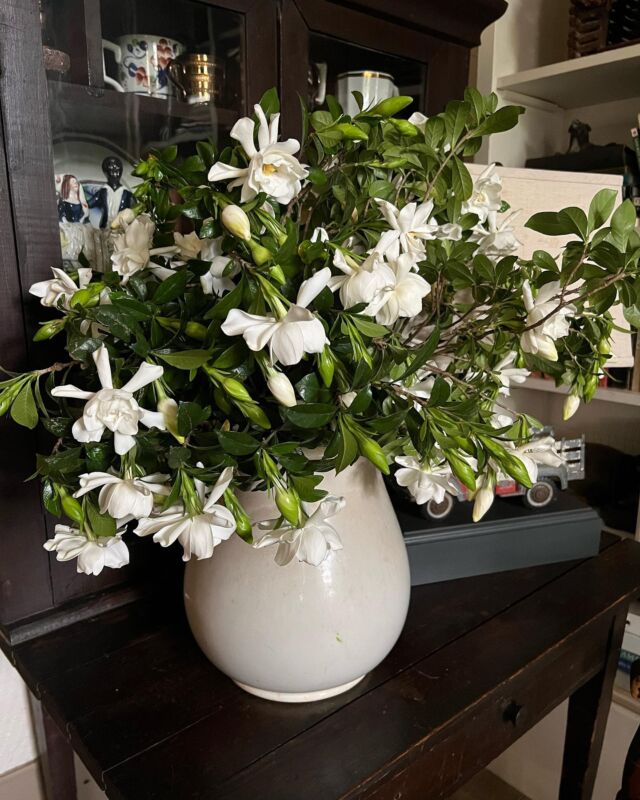
Locate an element on the screen. This screenshot has width=640, height=800. white pot is located at coordinates (332, 621).